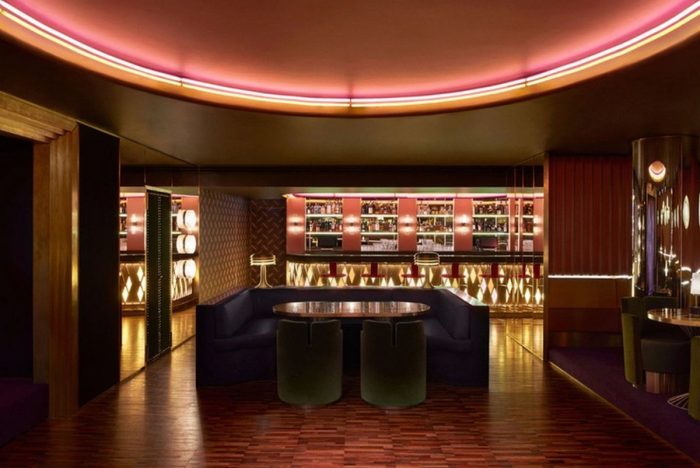
At what (x,y) coordinates should I click in order to perform the action: click on glass top table. Please return your answer as a coordinate pair (x, y). Looking at the image, I should click on (351, 305).